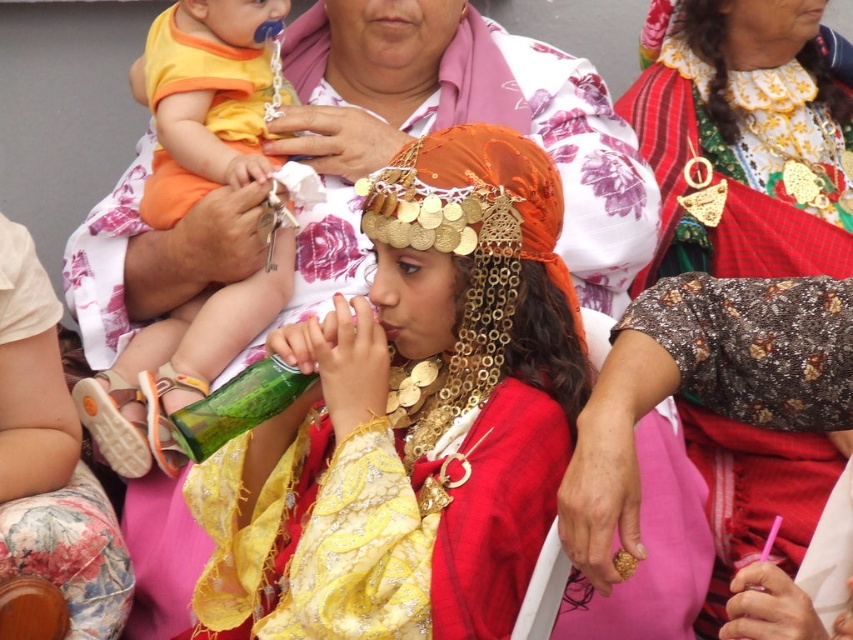
Question: Where is shiny metallic headpiece at center located in relation to matte orange bib at upper left in the image?

Choices:
 (A) below
 (B) above

Answer: (A)

Question: Does floral fabric dress at center have a larger size compared to shiny metallic headpiece at center?

Choices:
 (A) yes
 (B) no

Answer: (B)

Question: Among these objects, which one is nearest to the camera?

Choices:
 (A) floral fabric dress at center
 (B) green glass bottle at center
 (C) matte orange bib at upper left

Answer: (B)

Question: Which point appears closest to the camera in this image?

Choices:
 (A) (363, 44)
 (B) (781, 248)
 (C) (148, 90)
 (D) (224, 394)

Answer: (D)

Question: Which object is positioned closest to the matte orange bib at upper left?

Choices:
 (A) shiny metallic headpiece at center
 (B) green glass bottle at center
 (C) floral fabric dress at center

Answer: (A)

Question: Does shiny metallic headpiece at center have a larger size compared to green glass bottle at center?

Choices:
 (A) no
 (B) yes

Answer: (B)